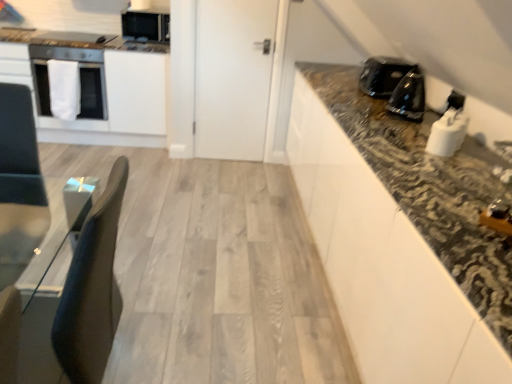
Question: From the image's perspective, would you say black glossy coffee maker at upper right is positioned over metallic silver toaster at upper left, which is the 3th appliance from bottom to top?

Choices:
 (A) yes
 (B) no

Answer: (B)

Question: From the image's perspective, is black glossy coffee maker at upper right beneath metallic silver toaster at upper left, which appears as the 4th appliance when viewed from the right?

Choices:
 (A) no
 (B) yes

Answer: (B)

Question: Considering the relative sizes of black glossy coffee maker at upper right and metallic silver toaster at upper left, which appears as the third appliance when viewed from the front, in the image provided, is black glossy coffee maker at upper right thinner than metallic silver toaster at upper left, which appears as the third appliance when viewed from the front,?

Choices:
 (A) yes
 (B) no

Answer: (A)

Question: From a real-world perspective, is black glossy coffee maker at upper right on top of metallic silver toaster at upper left, which appears as the 4th appliance when viewed from the right?

Choices:
 (A) yes
 (B) no

Answer: (A)

Question: Is black glossy coffee maker at upper right surrounding metallic silver toaster at upper left, which is the 3th appliance from bottom to top?

Choices:
 (A) no
 (B) yes

Answer: (A)

Question: Is black glossy coffee maker at upper right touching metallic silver toaster at upper left, the first appliance from the left?

Choices:
 (A) yes
 (B) no

Answer: (B)

Question: From the image's perspective, does black glossy kettle at right, which ranks as the third appliance in back-to-front order, appear lower than matte black microwave at upper left, acting as the 3th appliance starting from the right?

Choices:
 (A) yes
 (B) no

Answer: (A)

Question: Does black glossy kettle at right, which ranks as the third appliance in back-to-front order, have a larger size compared to matte black microwave at upper left, the 4th appliance in the bottom-to-top sequence?

Choices:
 (A) yes
 (B) no

Answer: (B)

Question: Considering the relative sizes of black glossy kettle at right, which appears as the 3th appliance when viewed from the top, and matte black microwave at upper left, which ranks as the fourth appliance in front-to-back order, in the image provided, is black glossy kettle at right, which appears as the 3th appliance when viewed from the top, taller than matte black microwave at upper left, which ranks as the fourth appliance in front-to-back order,?

Choices:
 (A) no
 (B) yes

Answer: (A)

Question: Is black glossy kettle at right, which ranks as the third appliance in back-to-front order, next to matte black microwave at upper left, acting as the 3th appliance starting from the right, and touching it?

Choices:
 (A) yes
 (B) no

Answer: (B)

Question: Is there a large distance between black glossy kettle at right, placed as the 3th appliance when sorted from left to right, and matte black microwave at upper left, placed as the 1th appliance when sorted from back to front?

Choices:
 (A) no
 (B) yes

Answer: (B)

Question: Is black glossy kettle at right, the second appliance in the front-to-back sequence, outside matte black microwave at upper left, the 4th appliance in the bottom-to-top sequence?

Choices:
 (A) yes
 (B) no

Answer: (A)

Question: Is matte black microwave at upper left, which ranks as the fourth appliance in front-to-back order, turned away from white glossy oven at left?

Choices:
 (A) yes
 (B) no

Answer: (B)